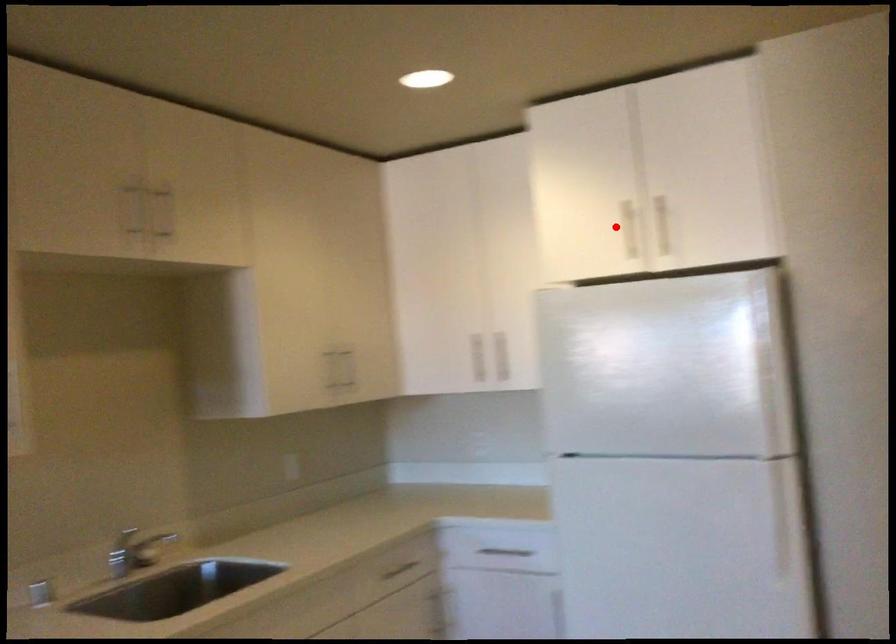
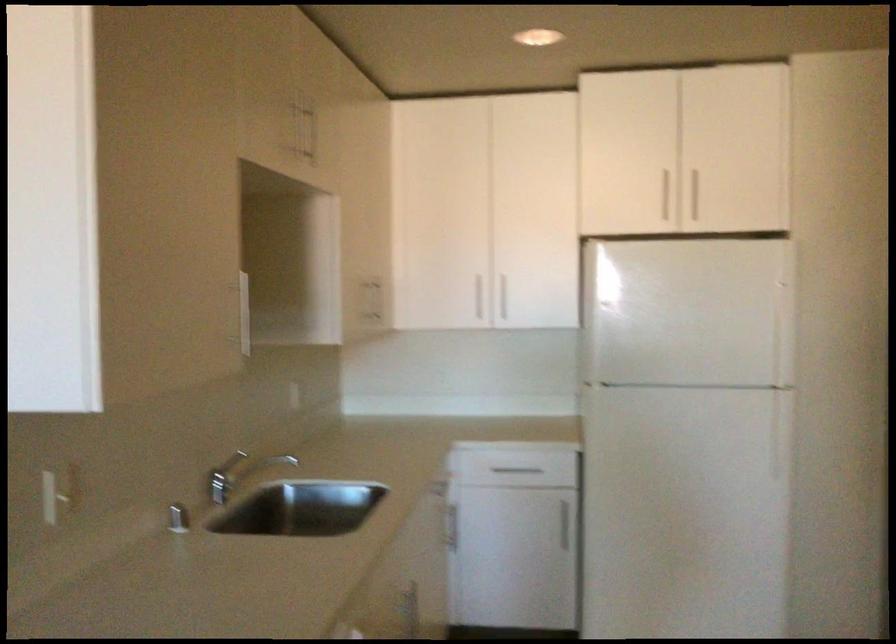
Question: I am providing you with two images of the same scene from different viewpoints. A red point is marked on the first image. Can you still see the location of the red point in image 2?

Choices:
 (A) Yes
 (B) No

Answer: (A)